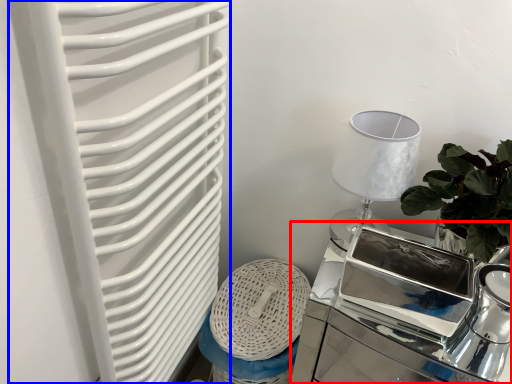
Question: Which object appears farthest to the camera in this image, table (highlighted by a red box) or radiator (highlighted by a blue box)?

Choices:
 (A) table
 (B) radiator

Answer: (A)